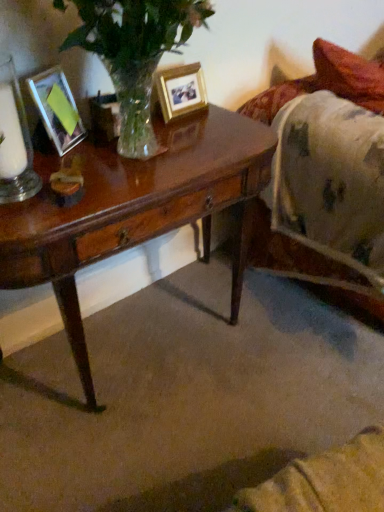
This screenshot has width=384, height=512. What are the coordinates of `empty space that is to the right of gold metallic photo frame at upper center, which ranks as the 2th picture frame in front-to-back order` in the screenshot? It's located at (239, 123).